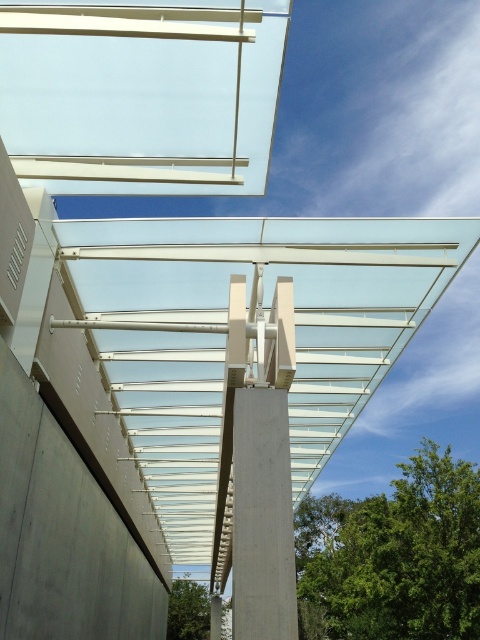
Question: Which of these objects is positioned farthest from the gray concrete wall at lower left?

Choices:
 (A) transparent glass roof at upper center
 (B) concrete pillar at center

Answer: (A)

Question: Is transparent glass roof at upper center smaller than gray concrete wall at lower left?

Choices:
 (A) yes
 (B) no

Answer: (A)

Question: Where is gray concrete wall at lower left located in relation to concrete pillar at center in the image?

Choices:
 (A) above
 (B) below

Answer: (B)

Question: Based on their relative distances, which object is nearer to the transparent glass roof at upper center?

Choices:
 (A) gray concrete wall at lower left
 (B) concrete pillar at center

Answer: (B)

Question: Which object is closer to the camera taking this photo?

Choices:
 (A) gray concrete wall at lower left
 (B) transparent glass roof at upper center

Answer: (B)

Question: Can you confirm if gray concrete wall at lower left is thinner than concrete pillar at center?

Choices:
 (A) yes
 (B) no

Answer: (A)